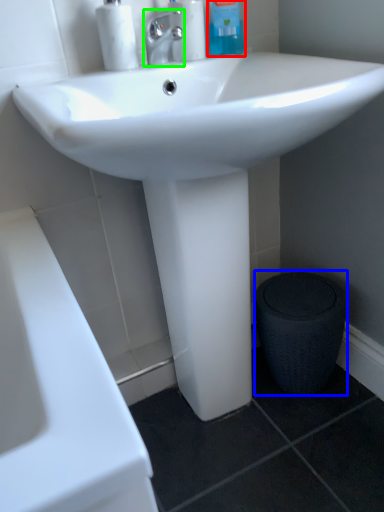
Question: Estimate the real-world distances between objects in this image. Which object is farther from cleaning product (highlighted by a red box), porcelain (highlighted by a blue box) or tap (highlighted by a green box)?

Choices:
 (A) porcelain
 (B) tap

Answer: (A)